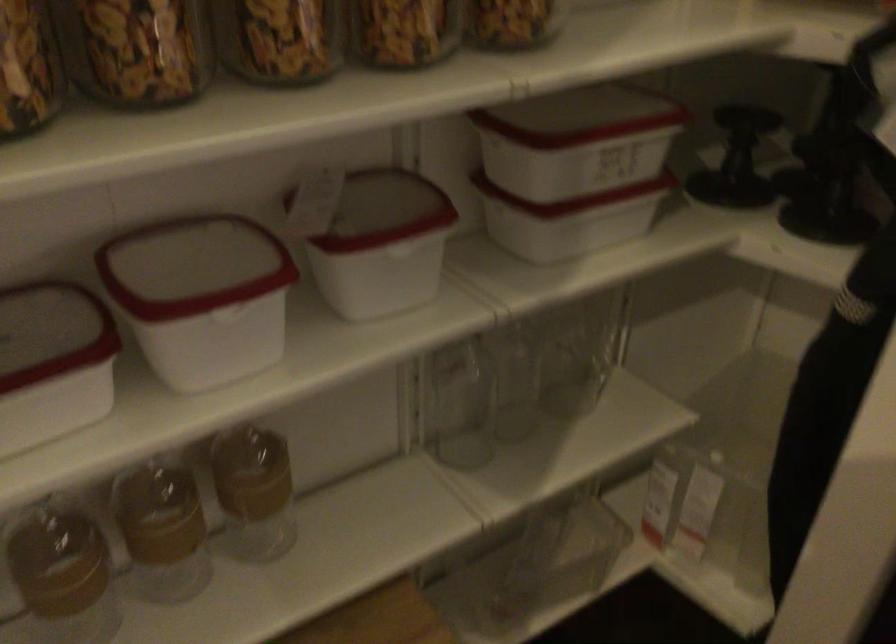
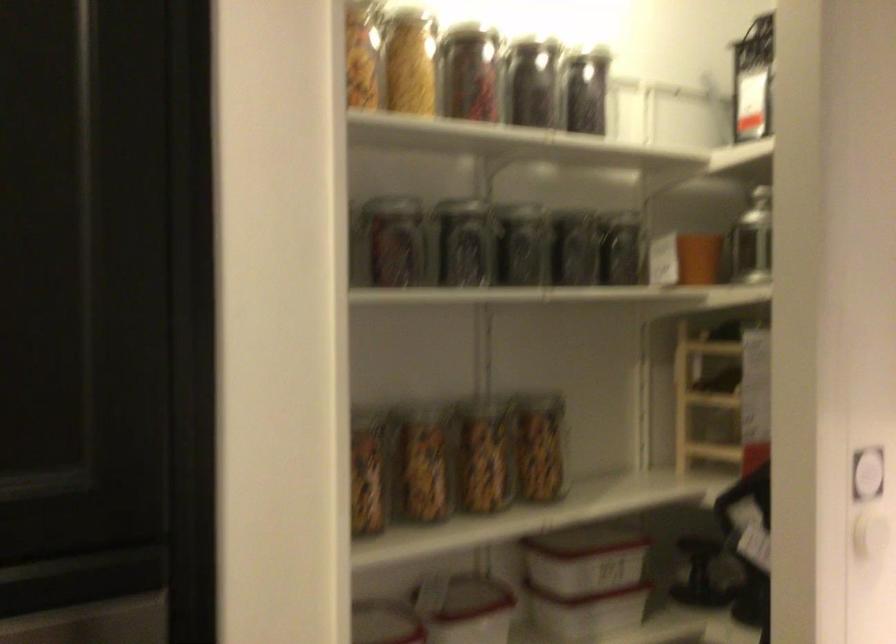
Where in the second image is the point corresponding to point 378,210 from the first image?

(464, 605)